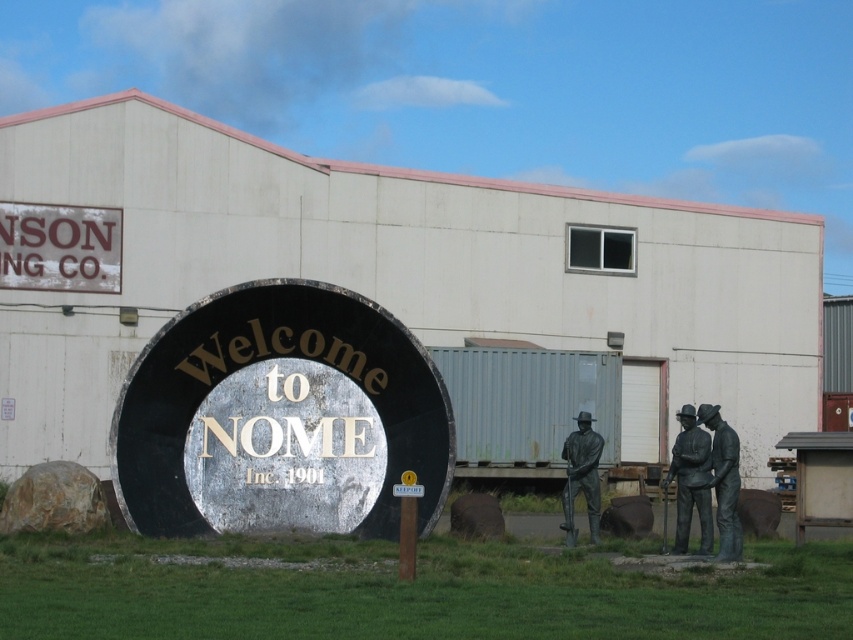
Is point (357, 424) positioned behind point (699, 444)?

Yes, point (357, 424) is farther from viewer.

Locate an element on the screen. Image resolution: width=853 pixels, height=640 pixels. metallic silver sign at center is located at coordinates (281, 417).

Describe the element at coordinates (59, 248) in the screenshot. I see `rustic brown sign at upper left` at that location.

Does point (106, 284) come farther from viewer compared to point (683, 477)?

Yes.

Identify the location of rustic brown sign at upper left. This screenshot has height=640, width=853. (59, 248).

In the scene shown: Is rustic brown sign at upper left behind bronze statue at right?

Yes, rustic brown sign at upper left is further from the viewer.

Who is higher up, rustic brown sign at upper left or bronze statue at right?

rustic brown sign at upper left is higher up.

Is point (62, 259) less distant than point (728, 432)?

No.

Identify the location of rustic brown sign at upper left. (59, 248).